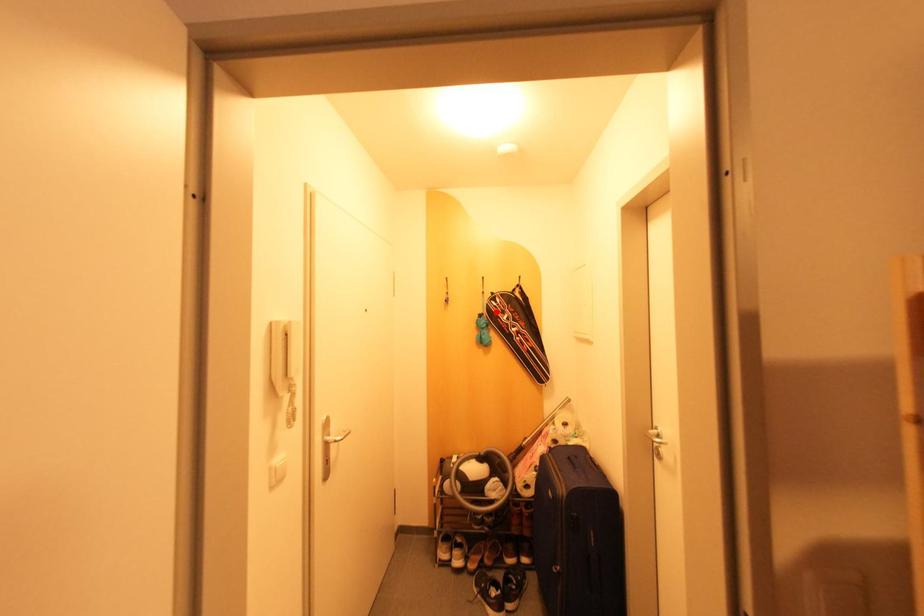
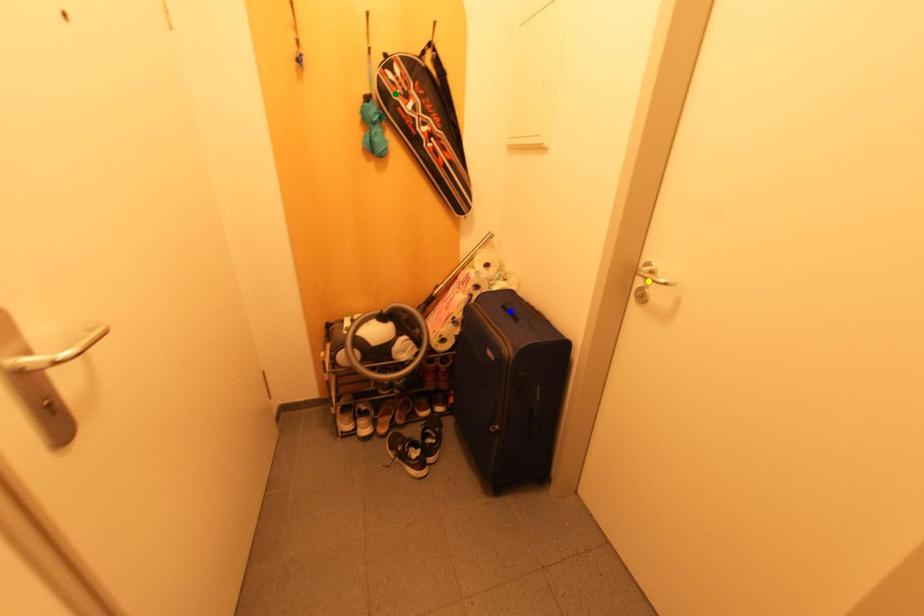
Question: I am providing you with two images of the same scene from different viewpoints. A red point is marked on the first image. You are given multiple points on the second image. In image 2, which mark is for the same physical point as the one in image 1?

Choices:
 (A) blue point
 (B) yellow point
 (C) green point

Answer: (C)